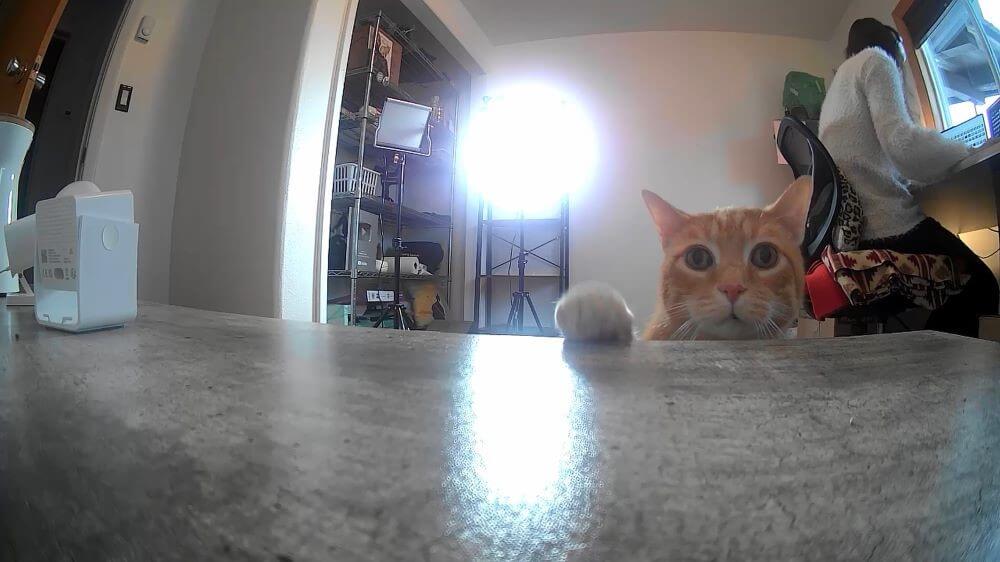
Where is `door`? The width and height of the screenshot is (1000, 562). door is located at coordinates (30, 40).